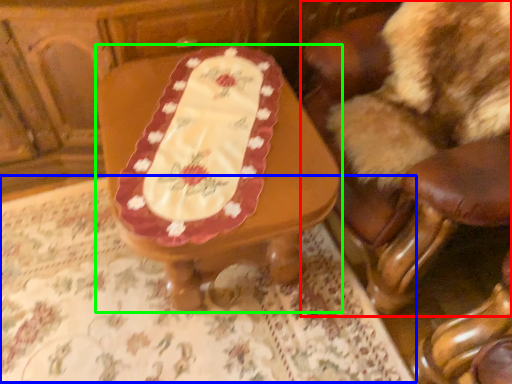
Question: Considering the real-world distances, which object is farthest from chair (highlighted by a red box)? tablecloth (highlighted by a blue box) or table (highlighted by a green box)?

Choices:
 (A) tablecloth
 (B) table

Answer: (A)